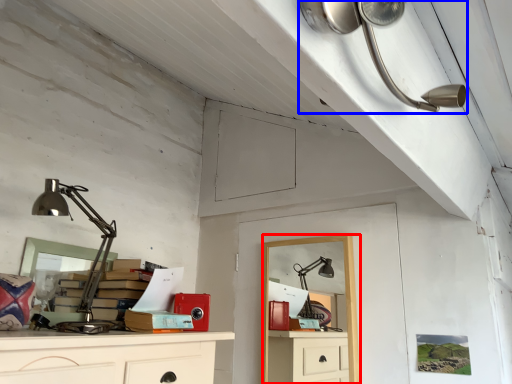
Question: Which point is further to the camera, computer desk (highlighted by a red box) or lamp (highlighted by a blue box)?

Choices:
 (A) computer desk
 (B) lamp

Answer: (A)